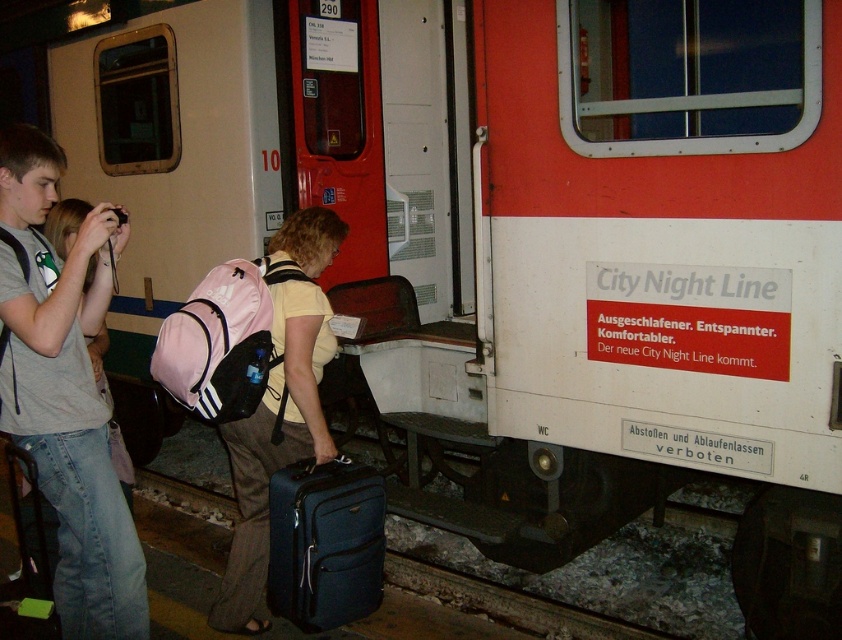
Question: Which of these objects is positioned farthest from the matte pink backpack at center?

Choices:
 (A) matte blue suitcase at lower center
 (B) gray cotton t-shirt at left

Answer: (B)

Question: Is gray cotton t-shirt at left bigger than matte blue suitcase at lower center?

Choices:
 (A) no
 (B) yes

Answer: (B)

Question: Which point is farther to the camera?

Choices:
 (A) (307, 632)
 (B) (254, 582)
 (C) (136, 577)

Answer: (B)

Question: Which point appears closest to the camera in this image?

Choices:
 (A) (265, 476)
 (B) (320, 499)

Answer: (B)

Question: Is the position of matte pink backpack at center less distant than that of matte blue suitcase at lower center?

Choices:
 (A) yes
 (B) no

Answer: (B)

Question: Where is gray cotton t-shirt at left located in relation to matte blue suitcase at lower center in the image?

Choices:
 (A) left
 (B) right

Answer: (A)